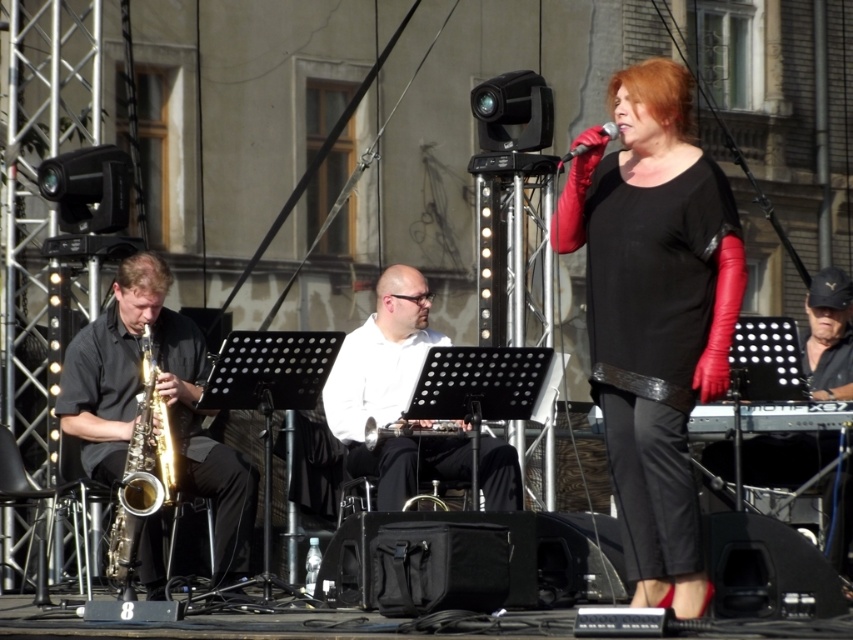
Question: In this image, where is black leather gloves at upper right located relative to shiny gold saxophone at left?

Choices:
 (A) right
 (B) left

Answer: (A)

Question: Is black leather gloves at upper right positioned before black matte microphone at center?

Choices:
 (A) yes
 (B) no

Answer: (A)

Question: Based on their relative distances, which object is farther from the black matte microphone at center?

Choices:
 (A) shiny gold saxophone at left
 (B) white smooth shirt at center

Answer: (A)

Question: Observing the image, what is the correct spatial positioning of white smooth shirt at center in reference to black matte microphone at center?

Choices:
 (A) right
 (B) left

Answer: (B)

Question: Which object appears closest to the camera in this image?

Choices:
 (A) white smooth shirt at center
 (B) black leather gloves at upper right

Answer: (B)

Question: Which object appears closest to the camera in this image?

Choices:
 (A) black leather gloves at upper right
 (B) shiny gold saxophone at left

Answer: (A)